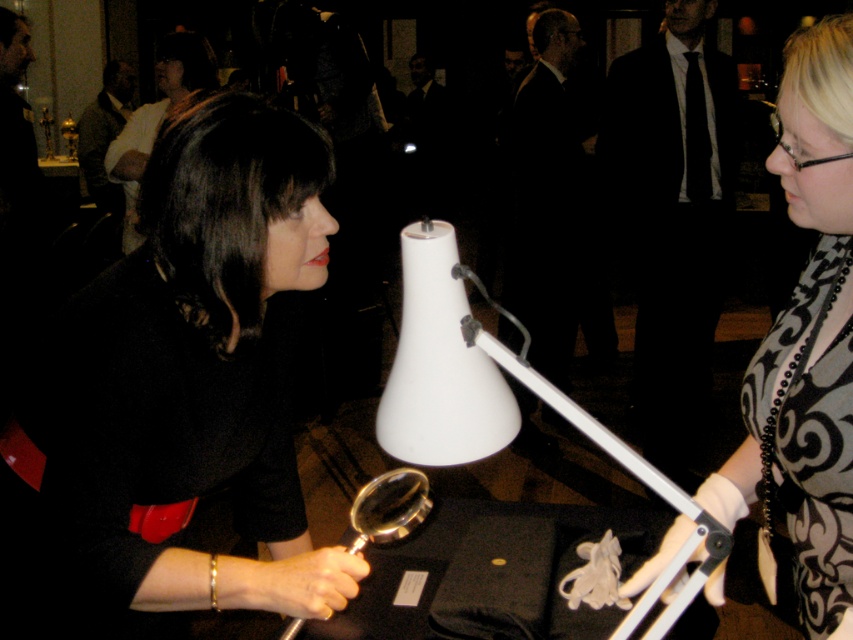
What is located at the coordinates point (x=194, y=376) in the image?

The point (x=194, y=376) indicates the location of the black matte dress at center.

You are a photographer at the event and need to capture a clear shot of both the black matte dress at center and the matte black dress at center. Since you can only focus on one subject at a time, which dress should you prioritize focusing on to ensure it appears sharp in the photo?

The black matte dress at center is closer to the viewer than the matte black dress at center, so focusing on it would ensure it appears sharp while the other may be slightly blurred due to depth of field limitations.